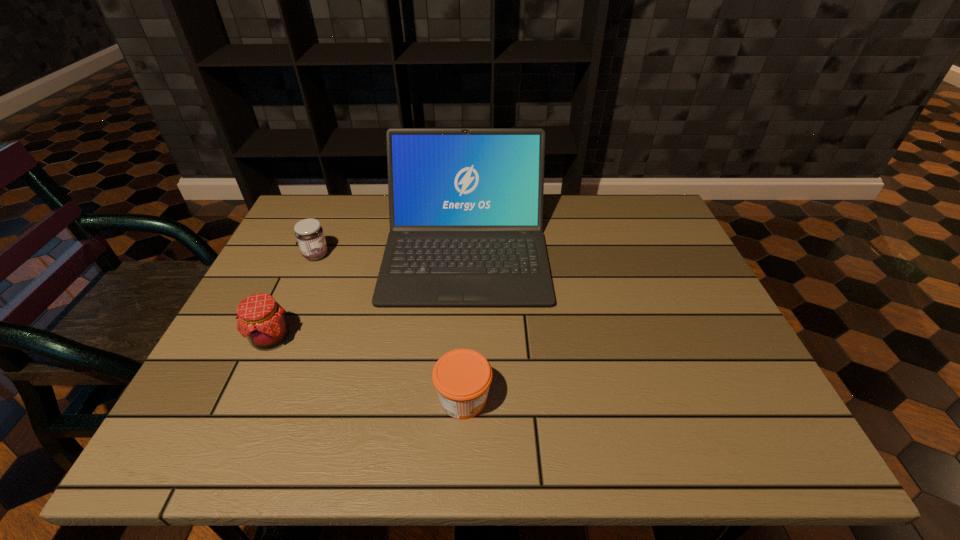
Image resolution: width=960 pixels, height=540 pixels. What are the coordinates of `free point between the nearest object and the second farthest jam` in the screenshot? It's located at (368, 368).

Locate an element on the screen. The width and height of the screenshot is (960, 540). unoccupied area between the farthest jam and the nearest object is located at coordinates (390, 327).

Where is `free area in between the nearest object and the tallest object`? The image size is (960, 540). free area in between the nearest object and the tallest object is located at coordinates (465, 325).

Where is `vacant space that is in between the tallest object and the third farthest object`? vacant space that is in between the tallest object and the third farthest object is located at coordinates click(369, 294).

At what (x,y) coordinates should I click in order to perform the action: click on the third closest object to the rightmost jam. Please return your answer as a coordinate pair (x, y). This screenshot has width=960, height=540. Looking at the image, I should click on (309, 234).

Find the location of a particular element. Image resolution: width=960 pixels, height=540 pixels. the second closest object to the farthest jam is located at coordinates (261, 319).

Where is `jam that stands as the third closest to the laptop computer`? The width and height of the screenshot is (960, 540). jam that stands as the third closest to the laptop computer is located at coordinates (462, 377).

Where is `the second closest jam to the second nearest object`? The width and height of the screenshot is (960, 540). the second closest jam to the second nearest object is located at coordinates (462, 377).

This screenshot has height=540, width=960. What are the coordinates of `free space that satisfies the following two spatial constraints: 1. on the screen of the laptop computer; 2. on the front label of the farthest jam` in the screenshot? It's located at coord(466,255).

Find the location of a particular element. vacant space that satisfies the following two spatial constraints: 1. on the screen of the tallest object; 2. on the front label of the farthest jam is located at coordinates (466, 255).